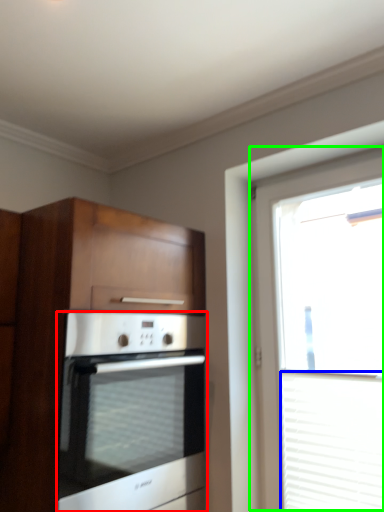
Question: Based on their relative distances, which object is farther from oven (highlighted by a red box)? Choose from blind (highlighted by a blue box) and window (highlighted by a green box).

Choices:
 (A) blind
 (B) window

Answer: (A)